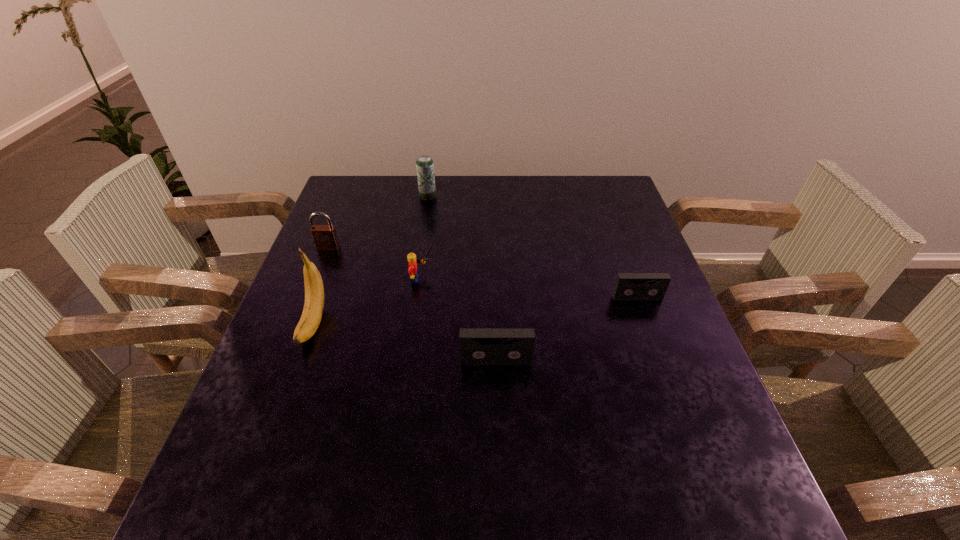
Identify the location of vacant region at the left edge. (340, 220).

Image resolution: width=960 pixels, height=540 pixels. In order to click on blank area at the right edge in this screenshot , I will do `click(653, 400)`.

Find the location of a particular element. vacant space at the far left corner of the desktop is located at coordinates (380, 188).

You are a GUI agent. You are given a task and a screenshot of the screen. Output one action in this format:
    pyautogui.click(x=<x>, y=<y>)
    Task: Click on the free space at the far right corner of the desktop
    Image resolution: width=960 pixels, height=540 pixels.
    Given the screenshot: What is the action you would take?
    pyautogui.click(x=585, y=199)

Locate an element on the screen. The width and height of the screenshot is (960, 540). vacant region at the near right corner of the desktop is located at coordinates (688, 416).

Locate an element on the screen. free space between the farthest object and the tallest object is located at coordinates (371, 260).

Locate an element on the screen. The height and width of the screenshot is (540, 960). free space between the beer can and the Lego is located at coordinates (426, 238).

Identify the location of vacant area that lies between the nearest object and the beer can. This screenshot has height=540, width=960. (462, 279).

This screenshot has height=540, width=960. I want to click on free space between the Lego and the nearer videotape, so pos(460,320).

This screenshot has width=960, height=540. I want to click on empty location between the farthest object and the nearest object, so click(462, 279).